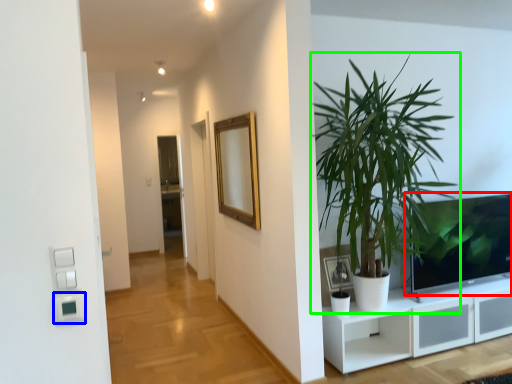
Question: Which is nearer to the television (highlighted by a red box)? light switch (highlighted by a blue box) or houseplant (highlighted by a green box).

Choices:
 (A) light switch
 (B) houseplant

Answer: (B)